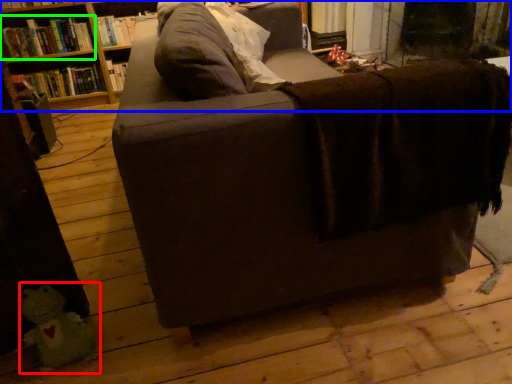
Question: Which object is the farthest from toy (highlighted by a red box)? Choose among these: shelf (highlighted by a blue box) or book (highlighted by a green box).

Choices:
 (A) shelf
 (B) book

Answer: (A)